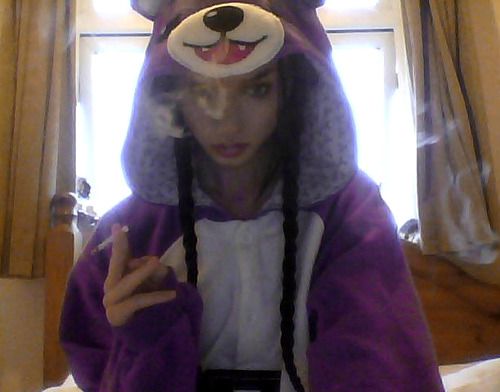
The width and height of the screenshot is (500, 392). In order to click on bed frame in this screenshot , I will do `click(65, 232)`.